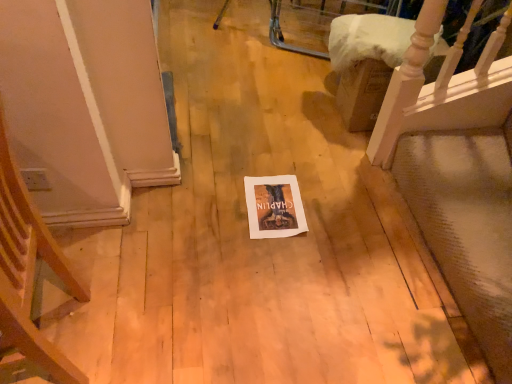
Find the location of a particular element. free spot below wooden armchair at left (from a real-world perspective) is located at coordinates (71, 335).